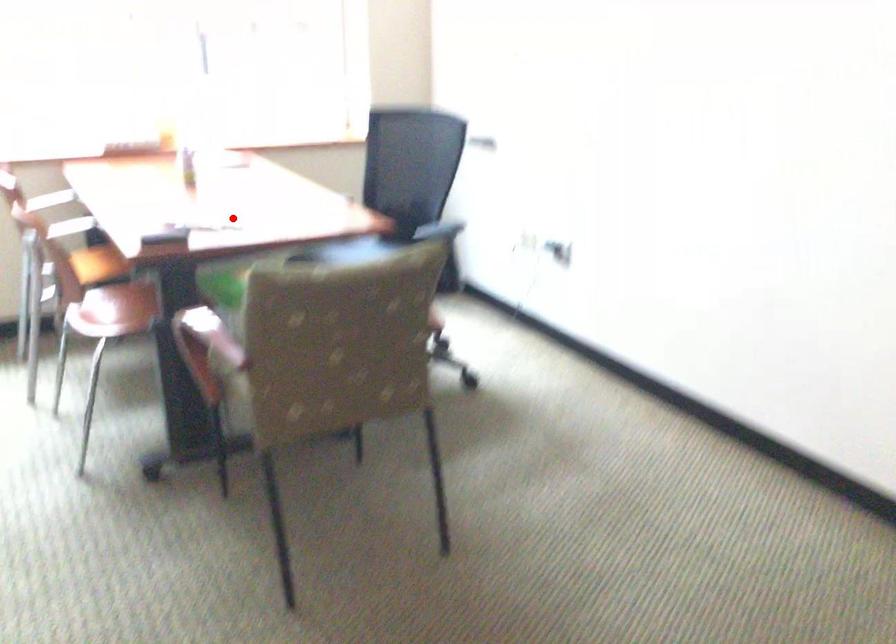
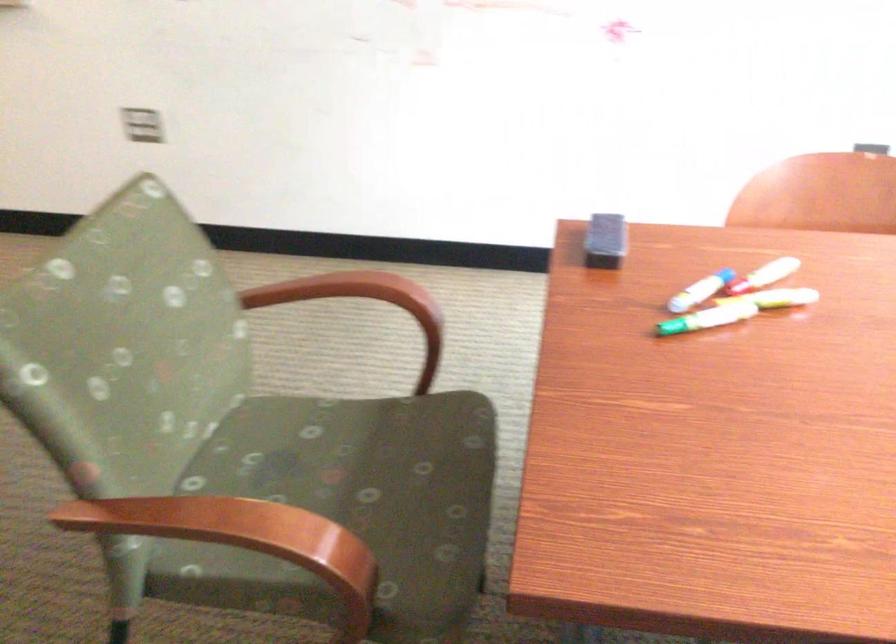
The point at the highlighted location is marked in the first image. Where is the corresponding point in the second image?

(675, 327)